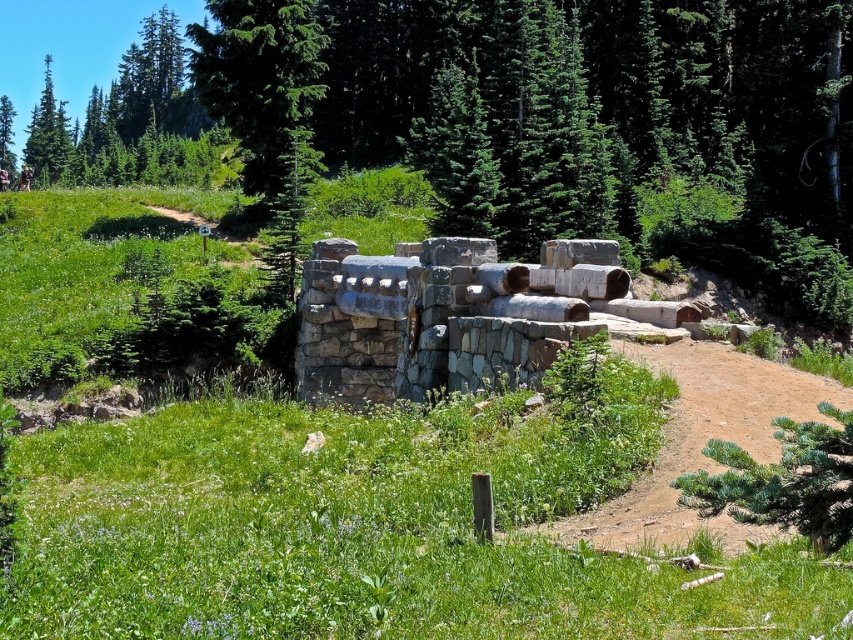
Question: Observing the image, what is the correct spatial positioning of green coniferous tree at upper left in reference to green textured tree at upper left?

Choices:
 (A) right
 (B) left

Answer: (A)

Question: Is green coniferous tree at upper left below green textured tree at upper left?

Choices:
 (A) no
 (B) yes

Answer: (B)

Question: Can you confirm if green coniferous tree at upper left is positioned to the left of green textured tree at upper left?

Choices:
 (A) yes
 (B) no

Answer: (B)

Question: Which point is farther from the camera taking this photo?

Choices:
 (A) (218, 48)
 (B) (36, 131)

Answer: (B)

Question: Which of the following is the farthest from the observer?

Choices:
 (A) green textured tree at upper left
 (B) green coniferous tree at upper left

Answer: (A)